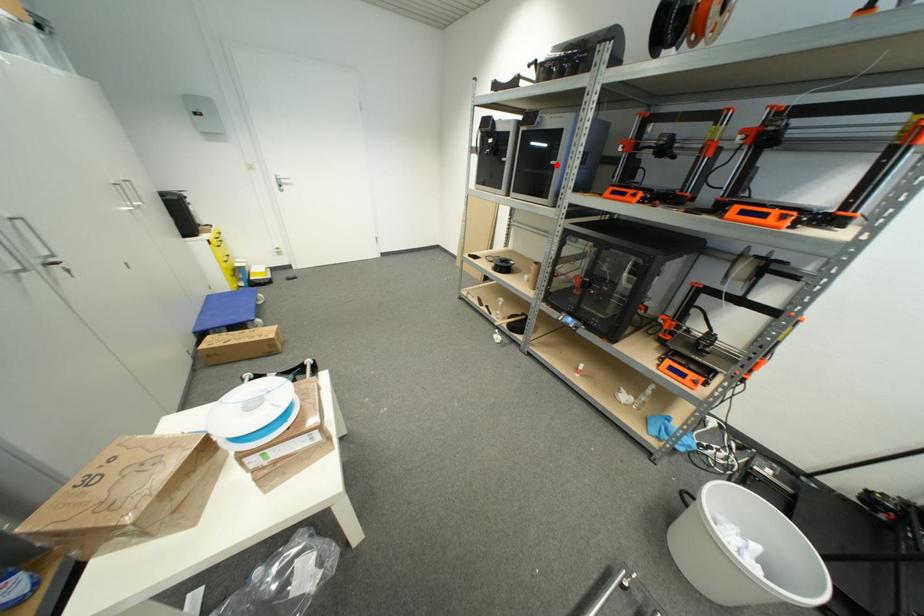
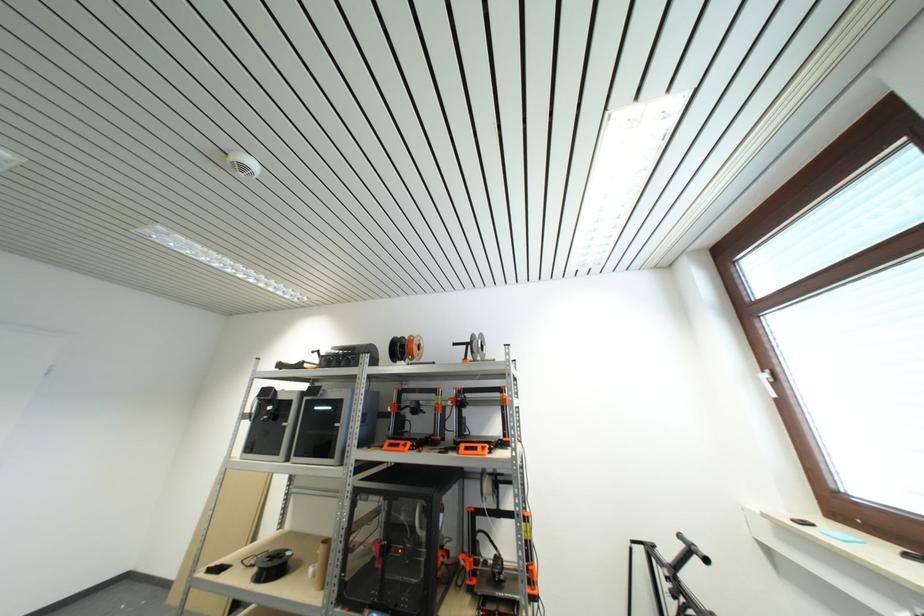
The point at the highlighted location is marked in the first image. Where is the corresponding point in the second image?

(341, 427)